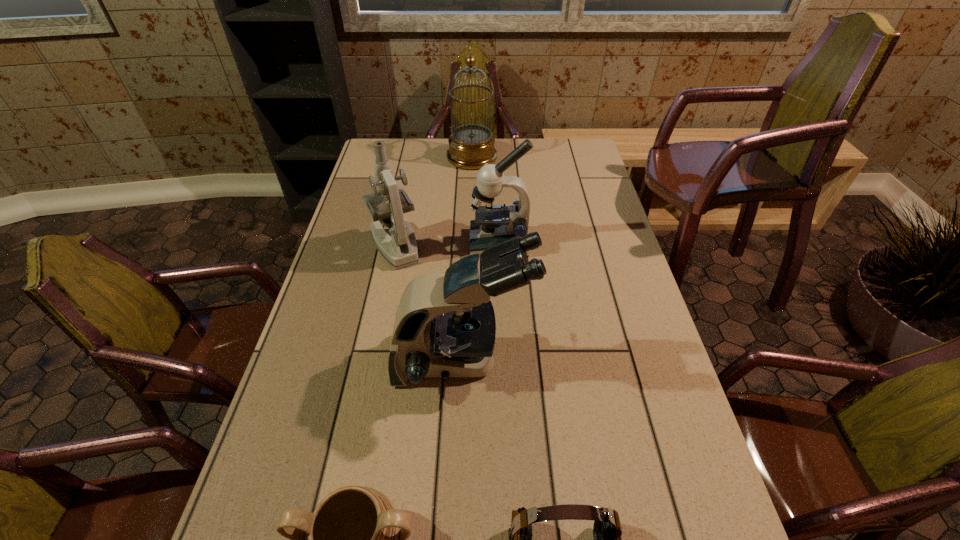
Find the location of a particular element. Image resolution: width=960 pixels, height=540 pixels. object that can be found as the fourth closest to the fourth farthest object is located at coordinates (493, 225).

Identify the location of object that is the fifth nearest to the headset. The image size is (960, 540). (471, 146).

Select which microscope appears as the second closest to the nearest microscope. Please provide its 2D coordinates. Your answer should be formatted as a tuple, i.e. [(x, y)], where the tuple contains the x and y coordinates of a point satisfying the conditions above.

[(493, 225)]

Select which microscope appears as the second closest to the urn. Please provide its 2D coordinates. Your answer should be formatted as a tuple, i.e. [(x, y)], where the tuple contains the x and y coordinates of a point satisfying the conditions above.

[(400, 250)]